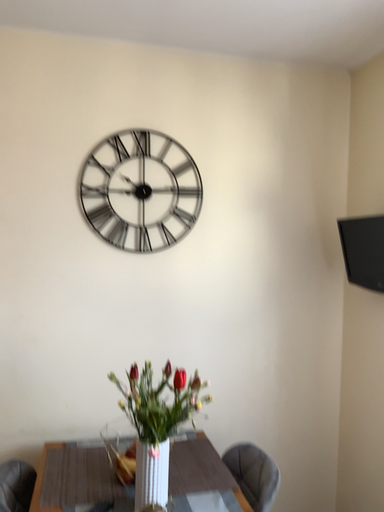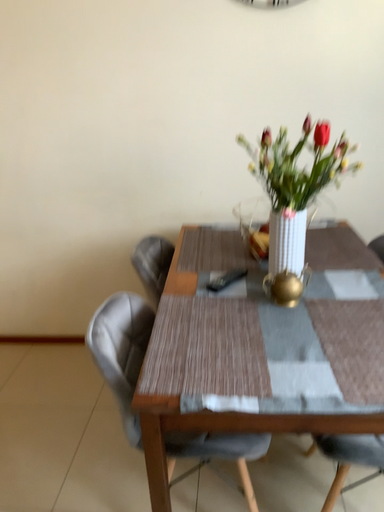
Question: Which way did the camera rotate in the video?

Choices:
 (A) rotated right
 (B) rotated left

Answer: (B)